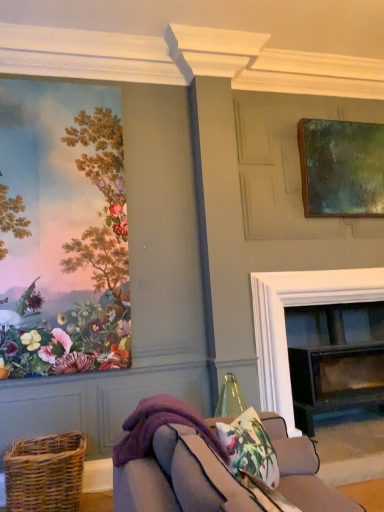
At what (x,y) coordinates should I click in order to perform the action: click on free point above matte floral wallpaper at left, positioned as the 2th picture frame in back-to-front order (from a real-world perspective). Please return your answer as a coordinate pair (x, y). Image resolution: width=384 pixels, height=512 pixels. Looking at the image, I should click on (57, 82).